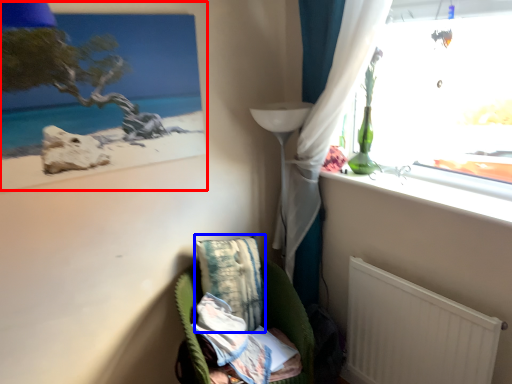
Question: Among these objects, which one is nearest to the camera, picture frame (highlighted by a red box) or pillow (highlighted by a blue box)?

Choices:
 (A) picture frame
 (B) pillow

Answer: (A)